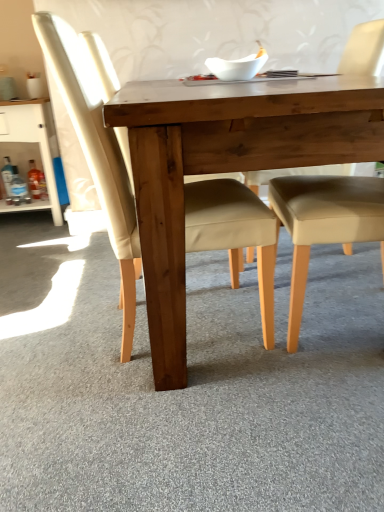
Question: Can you confirm if matte wood chair at center, which is the 1th chair from left to right, is smaller than natural wood table at center?

Choices:
 (A) yes
 (B) no

Answer: (A)

Question: Is matte wood chair at center, which is the 1th chair from left to right, far away from natural wood table at center?

Choices:
 (A) yes
 (B) no

Answer: (B)

Question: Can you confirm if matte wood chair at center, placed as the second chair when sorted from right to left, is wider than natural wood table at center?

Choices:
 (A) no
 (B) yes

Answer: (A)

Question: Is matte wood chair at center, placed as the second chair when sorted from right to left, not within natural wood table at center?

Choices:
 (A) no
 (B) yes

Answer: (A)

Question: From the image's perspective, is matte wood chair at center, placed as the second chair when sorted from right to left, located beneath natural wood table at center?

Choices:
 (A) no
 (B) yes

Answer: (B)

Question: Is matte wood chair at center, placed as the second chair when sorted from right to left, oriented away from natural wood table at center?

Choices:
 (A) yes
 (B) no

Answer: (A)

Question: Does beige leather chair at center, marked as the second chair in a left-to-right arrangement, have a greater height compared to matte wood chair at center, placed as the second chair when sorted from right to left?

Choices:
 (A) yes
 (B) no

Answer: (B)

Question: Can you confirm if beige leather chair at center, marked as the second chair in a left-to-right arrangement, is thinner than matte wood chair at center, which is the 1th chair from left to right?

Choices:
 (A) no
 (B) yes

Answer: (B)

Question: Does beige leather chair at center, marked as the second chair in a left-to-right arrangement, have a greater width compared to matte wood chair at center, placed as the second chair when sorted from right to left?

Choices:
 (A) yes
 (B) no

Answer: (B)

Question: From a real-world perspective, is beige leather chair at center, marked as the second chair in a left-to-right arrangement, under matte wood chair at center, which is the 1th chair from left to right?

Choices:
 (A) yes
 (B) no

Answer: (A)

Question: Would you say beige leather chair at center, acting as the first chair starting from the right, contains matte wood chair at center, placed as the second chair when sorted from right to left?

Choices:
 (A) yes
 (B) no

Answer: (B)

Question: Is beige leather chair at center, marked as the second chair in a left-to-right arrangement, completely or partially outside of matte wood chair at center, placed as the second chair when sorted from right to left?

Choices:
 (A) no
 (B) yes

Answer: (B)

Question: Is matte wood chair at center, placed as the second chair when sorted from right to left, oriented away from white glossy cabinet at left?

Choices:
 (A) yes
 (B) no

Answer: (B)